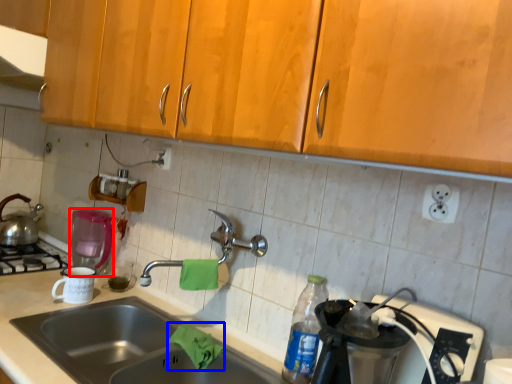
Question: Which object appears farthest to the camera in this image, coffee machine (highlighted by a red box) or material (highlighted by a blue box)?

Choices:
 (A) coffee machine
 (B) material

Answer: (A)